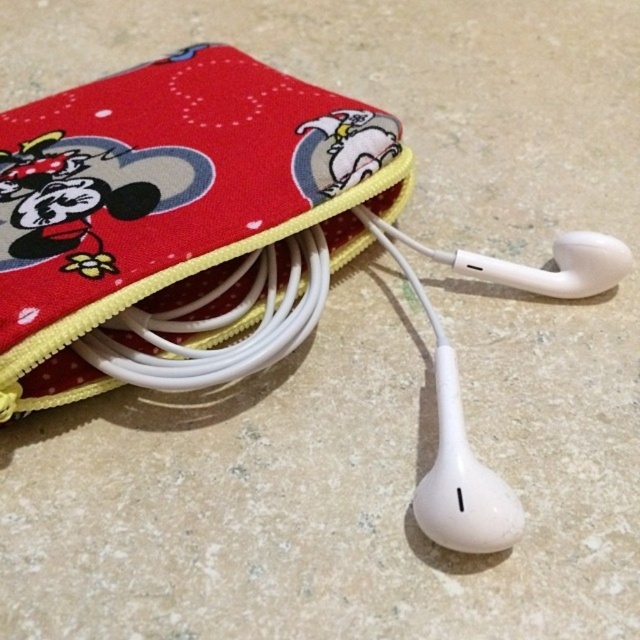
Question: Can you confirm if matte fabric pouch at upper left is positioned above white matte earphones at center?

Choices:
 (A) no
 (B) yes

Answer: (B)

Question: Which point is farther to the camera?

Choices:
 (A) white matte earphones at center
 (B) matte fabric pouch at upper left

Answer: (B)

Question: Which of the following is the farthest from the observer?

Choices:
 (A) white matte earphones at center
 (B) matte fabric pouch at upper left

Answer: (B)

Question: Is matte fabric pouch at upper left wider than white matte earphones at center?

Choices:
 (A) yes
 (B) no

Answer: (A)

Question: Does matte fabric pouch at upper left appear on the right side of white matte earphones at center?

Choices:
 (A) yes
 (B) no

Answer: (B)